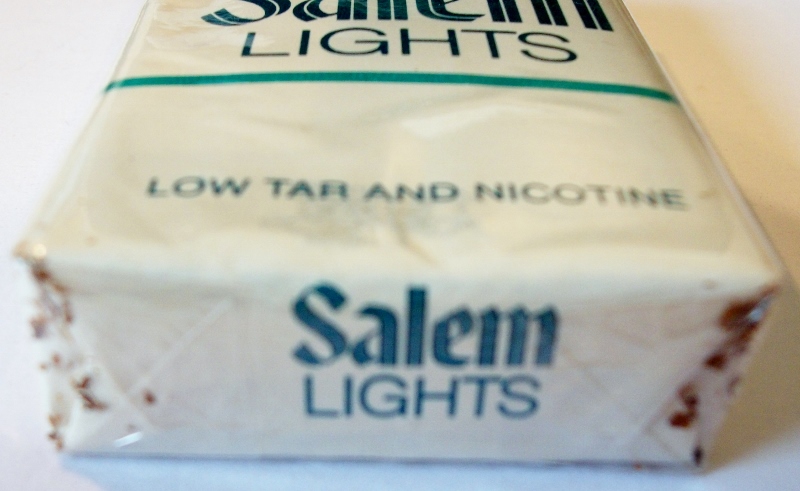
Identify the location of lights. (470, 47).